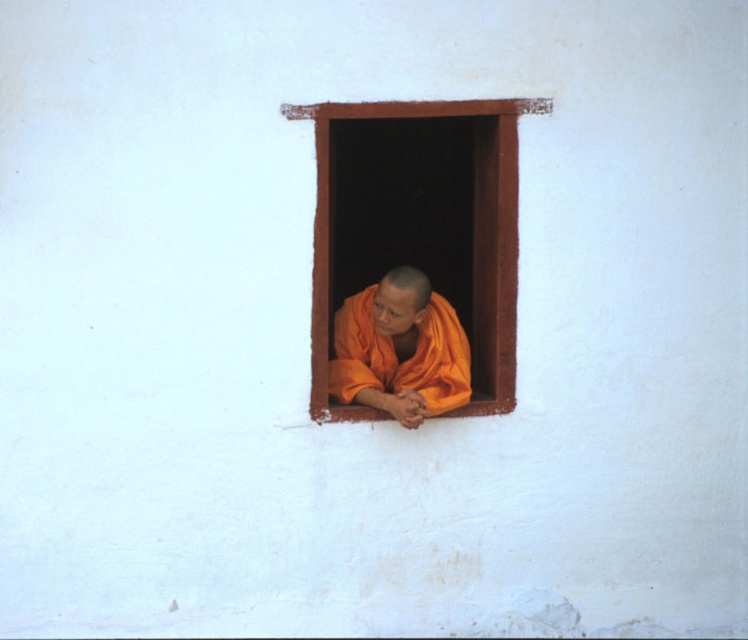
Question: Does orange cloth monk at center have a smaller size compared to brown wooden window at center?

Choices:
 (A) yes
 (B) no

Answer: (A)

Question: Which point is closer to the camera taking this photo?

Choices:
 (A) (453, 332)
 (B) (545, 100)

Answer: (B)

Question: Does orange cloth monk at center have a smaller size compared to brown wooden window at center?

Choices:
 (A) yes
 (B) no

Answer: (A)

Question: Does orange cloth monk at center appear on the right side of brown wooden window at center?

Choices:
 (A) no
 (B) yes

Answer: (A)